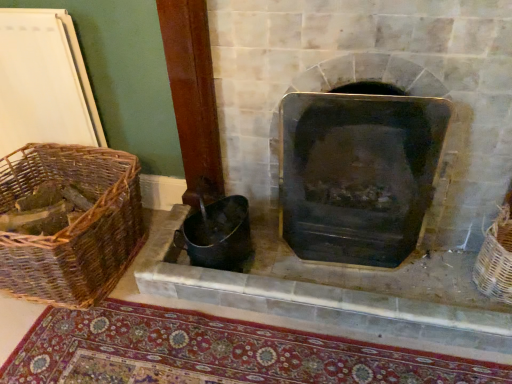
Question: Is woven brown basket at left, the second basket positioned from the right, wider than woven wicker basket at right, arranged as the 1th basket when viewed from the right?

Choices:
 (A) yes
 (B) no

Answer: (A)

Question: Is woven brown basket at left, the second basket positioned from the right, completely or partially outside of woven wicker basket at right, the 2th basket positioned from the left?

Choices:
 (A) yes
 (B) no

Answer: (A)

Question: Is woven brown basket at left, placed as the first basket when sorted from left to right, not near woven wicker basket at right, the 2th basket positioned from the left?

Choices:
 (A) yes
 (B) no

Answer: (A)

Question: Can woven wicker basket at right, arranged as the 1th basket when viewed from the right, be found inside woven brown basket at left, placed as the first basket when sorted from left to right?

Choices:
 (A) no
 (B) yes

Answer: (A)

Question: Can you confirm if woven brown basket at left, placed as the first basket when sorted from left to right, is bigger than woven wicker basket at right, the 2th basket positioned from the left?

Choices:
 (A) yes
 (B) no

Answer: (A)

Question: Does point (111, 150) appear closer or farther from the camera than point (429, 347)?

Choices:
 (A) farther
 (B) closer

Answer: (A)

Question: Looking at their shapes, would you say woven brown basket at left, the second basket positioned from the right, is wider or thinner than black metal fireplace at center?

Choices:
 (A) wide
 (B) thin

Answer: (A)

Question: Based on their sizes in the image, would you say woven brown basket at left, placed as the first basket when sorted from left to right, is bigger or smaller than black metal fireplace at center?

Choices:
 (A) big
 (B) small

Answer: (A)

Question: Considering their positions, is woven brown basket at left, placed as the first basket when sorted from left to right, located in front of or behind black metal fireplace at center?

Choices:
 (A) front
 (B) behind

Answer: (B)

Question: Considering the positions of point (10, 362) and point (109, 256), is point (10, 362) closer or farther from the camera than point (109, 256)?

Choices:
 (A) farther
 (B) closer

Answer: (B)

Question: From a real-world perspective, is carpeted mat at lower center positioned above or below woven brown basket at left, the second basket positioned from the right?

Choices:
 (A) above
 (B) below

Answer: (B)

Question: Would you say carpeted mat at lower center is to the left or to the right of woven brown basket at left, placed as the first basket when sorted from left to right, in the picture?

Choices:
 (A) left
 (B) right

Answer: (B)

Question: Do you think carpeted mat at lower center is within woven brown basket at left, placed as the first basket when sorted from left to right, or outside of it?

Choices:
 (A) outside
 (B) inside

Answer: (A)

Question: From the image's perspective, is black metal fireplace at center positioned above or below carpeted mat at lower center?

Choices:
 (A) above
 (B) below

Answer: (A)

Question: Considering the positions of black metal fireplace at center and carpeted mat at lower center in the image, is black metal fireplace at center wider or thinner than carpeted mat at lower center?

Choices:
 (A) thin
 (B) wide

Answer: (A)